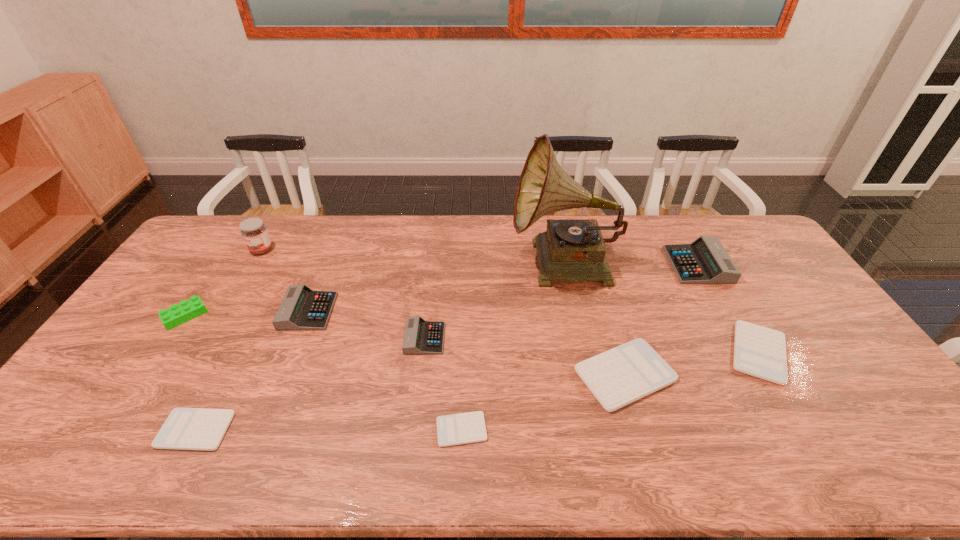
Image resolution: width=960 pixels, height=540 pixels. I want to click on free space in the image that satisfies the following two spatial constraints: 1. on the front side of the rightmost gray calculator; 2. on the left side of the ninth shortest object, so (x=252, y=265).

At what (x,y) coordinates should I click in order to perform the action: click on free space that satisfies the following two spatial constraints: 1. on the front side of the sixth tallest object; 2. on the left side of the fourth shortest calculator. Please return your answer as a coordinate pair (x, y). This screenshot has height=540, width=960. Looking at the image, I should click on click(420, 375).

This screenshot has height=540, width=960. Find the location of `free spot that satisfies the following two spatial constraints: 1. on the front side of the farthest calculator; 2. on the left side of the red jam`. free spot that satisfies the following two spatial constraints: 1. on the front side of the farthest calculator; 2. on the left side of the red jam is located at coordinates (252, 265).